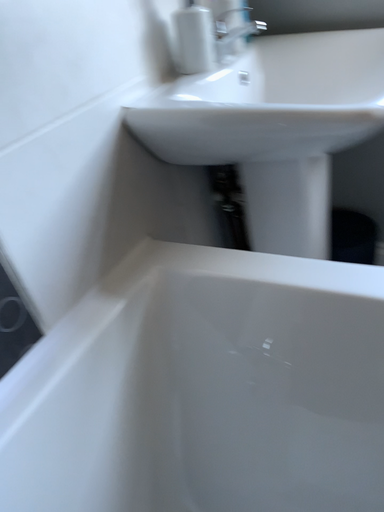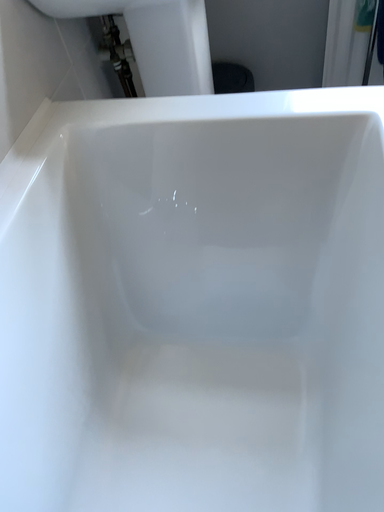
Question: How did the camera likely rotate when shooting the video?

Choices:
 (A) rotated left
 (B) rotated right

Answer: (B)